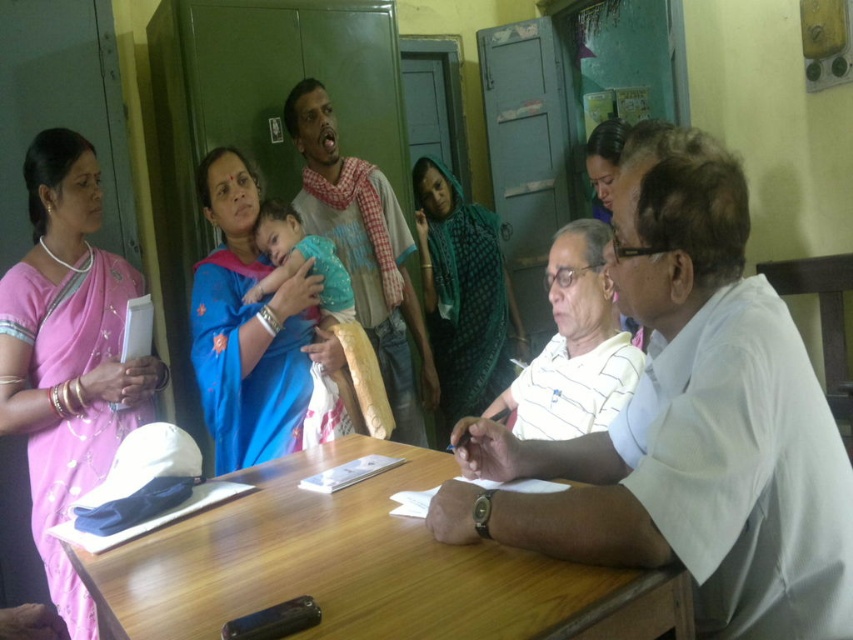
You are a visitor in the office and need to locate the wooden table at center and the gray cotton shirt at center. From the perspective of someone standing at the entrance facing the scene, which object is positioned to the left?

The gray cotton shirt at center is to the left of the wooden table at center, so the gray cotton shirt at center is positioned to the left.

You are looking at the image and want to determine which of the two points, point (457, 529) or point (97, 296), is nearer to you. Based on the coordinates provided, can you identify the closer point?

Point (457, 529) is closer to the camera than point (97, 296), so the closer point is point (457, 529).

You are a visitor in the office and want to know which of the two points, point [344,440] or point [618,141], is closer to you. Can you determine this based on the scene?

Point [344,440] is closer to the viewer than point [618,141].